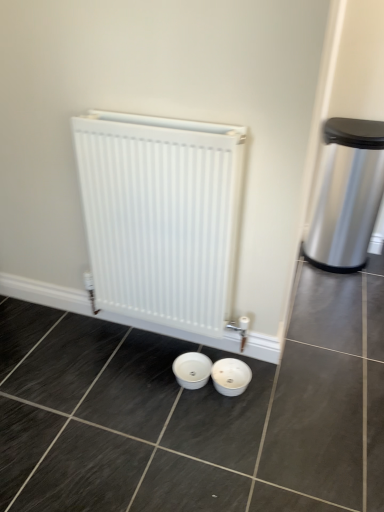
Find the location of a particular element. This screenshot has height=512, width=384. white glossy basin at center is located at coordinates (231, 376).

What do you see at coordinates (161, 216) in the screenshot? I see `white matte radiator at center` at bounding box center [161, 216].

What are the coordinates of `white glossy basin at center` in the screenshot? It's located at (231, 376).

At what (x,y) coordinates should I click in order to perform the action: click on waste container above the white glossy basin at center (from the image's perspective). Please return your answer as a coordinate pair (x, y). Looking at the image, I should click on (346, 194).

From the image's perspective, is white glossy basin at center located above or below polished stainless steel trash can at right?

white glossy basin at center is situated lower than polished stainless steel trash can at right in the image.

Considering the relative sizes of white glossy basin at center and polished stainless steel trash can at right in the image provided, is white glossy basin at center thinner than polished stainless steel trash can at right?

Indeed, white glossy basin at center has a lesser width compared to polished stainless steel trash can at right.

Does white glossy basin at center come behind polished stainless steel trash can at right?

No, white glossy basin at center is in front of polished stainless steel trash can at right.

Which object is further away from the camera, white glossy basin at center or white matte radiator at center?

white glossy basin at center is more distant.

Does point (240, 377) appear closer or farther from the camera than point (187, 263)?

Point (240, 377).

Between white glossy basin at center and white matte radiator at center, which one has less height?

Standing shorter between the two is white glossy basin at center.

From a real-world perspective, is white glossy basin at center on top of white matte radiator at center?

Actually, white glossy basin at center is physically below white matte radiator at center in the real world.

Considering the relative sizes of white matte radiator at center and white glossy basin at center in the image provided, is white matte radiator at center shorter than white glossy basin at center?

No.

From the image's perspective, is white matte radiator at center above or below white glossy basin at center?

white matte radiator at center is above white glossy basin at center.

Is white matte radiator at center wider or thinner than white glossy basin at center?

In the image, white matte radiator at center appears to be more narrow than white glossy basin at center.

Based on their sizes in the image, would you say white matte radiator at center is bigger or smaller than white glossy basin at center?

Considering their sizes, white matte radiator at center takes up more space than white glossy basin at center.

Is point (335, 247) farther from camera compared to point (240, 385)?

That is True.

Between polished stainless steel trash can at right and white glossy basin at center, which one has less height?

white glossy basin at center is shorter.

Is polished stainless steel trash can at right surrounding white glossy basin at center?

No, white glossy basin at center is located outside of polished stainless steel trash can at right.

Based on their positions, is polished stainless steel trash can at right located to the left or right of white glossy basin at center?

polished stainless steel trash can at right is to the right of white glossy basin at center.

Who is shorter, polished stainless steel trash can at right or white matte radiator at center?

With less height is polished stainless steel trash can at right.

Is polished stainless steel trash can at right in front of white matte radiator at center?

No, polished stainless steel trash can at right is further to the viewer.

Visually, is polished stainless steel trash can at right positioned to the left or to the right of white matte radiator at center?

Clearly, polished stainless steel trash can at right is on the right of white matte radiator at center in the image.

You are a GUI agent. You are given a task and a screenshot of the screen. Output one action in this format:
    pyautogui.click(x=<x>, y=<y>)
    Task: Click on the waste container above the white matte radiator at center (from the image's perspective)
    The height and width of the screenshot is (512, 384).
    Given the screenshot: What is the action you would take?
    pyautogui.click(x=346, y=194)

Can you confirm if white matte radiator at center is taller than polished stainless steel trash can at right?

Indeed, white matte radiator at center has a greater height compared to polished stainless steel trash can at right.

From the image's perspective, does white matte radiator at center appear lower than polished stainless steel trash can at right?

Yes, from the image's perspective, white matte radiator at center is beneath polished stainless steel trash can at right.

Is point (84, 192) closer or farther from the camera than point (351, 191)?

Point (84, 192).

Does white matte radiator at center have a larger size compared to polished stainless steel trash can at right?

Actually, white matte radiator at center might be smaller than polished stainless steel trash can at right.

The width and height of the screenshot is (384, 512). Identify the location of waste container on the right of white glossy basin at center. (346, 194).

Where is `basin that is below the white matte radiator at center (from the image's perspective)`? The image size is (384, 512). basin that is below the white matte radiator at center (from the image's perspective) is located at coordinates (231, 376).

From the picture: Based on their spatial positions, is white matte radiator at center or white glossy basin at center further from polished stainless steel trash can at right?

white glossy basin at center is positioned further to the anchor polished stainless steel trash can at right.

Estimate the real-world distances between objects in this image. Which object is further from white matte radiator at center, polished stainless steel trash can at right or white glossy basin at center?

polished stainless steel trash can at right lies further to white matte radiator at center than the other object.

Based on the photo, estimate the real-world distances between objects in this image. Which object is further from white glossy basin at center, white matte radiator at center or polished stainless steel trash can at right?

polished stainless steel trash can at right lies further to white glossy basin at center than the other object.

Estimate the real-world distances between objects in this image. Which object is further from white matte radiator at center, white glossy basin at center or polished stainless steel trash can at right?

polished stainless steel trash can at right is positioned further to the anchor white matte radiator at center.

Considering their positions, is white glossy basin at center positioned closer to polished stainless steel trash can at right than white matte radiator at center?

Based on the image, white matte radiator at center appears to be nearer to polished stainless steel trash can at right.

Based on their spatial positions, is polished stainless steel trash can at right or white matte radiator at center further from white glossy basin at center?

polished stainless steel trash can at right is positioned further to the anchor white glossy basin at center.

Locate an element on the screen. The height and width of the screenshot is (512, 384). basin situated between white matte radiator at center and polished stainless steel trash can at right from left to right is located at coordinates (x=231, y=376).